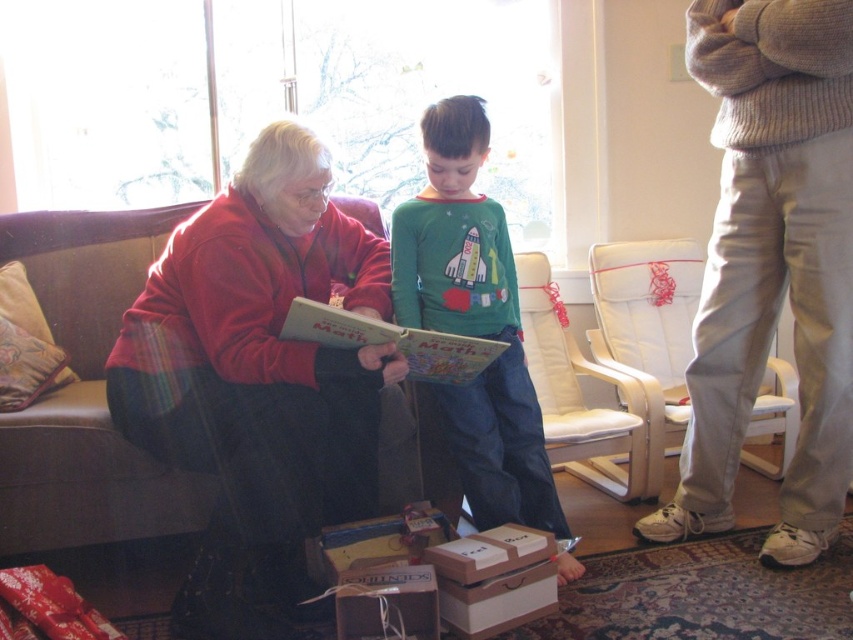
You are a delivery person who needs to place a small package on the lowest shelf of a bookshelf. You see the velvet red sweater at left and the wooden box at lower center. Which object is closer to the floor?

The wooden box at lower center is closer to the floor since it is shorter than the velvet red sweater at left, which is much taller.

You are a delivery person trying to place a large package that is 1.2 meters wide between the beige knit sweater at right and the white leather armchair at center. Can you fit the package between them?

The beige knit sweater at right might be wider than the white leather armchair at center, so the space between them may not be wide enough to accommodate the 1.2 meter package. You should check the exact width before placing it.

You are a furniture designer who wants to place a new small table between the white leather armchair at right and the wooden box at lower center. Considering their heights, which object should the table be placed closer to in order to ensure stability?

The white leather armchair at right is much taller than the wooden box at lower center. To ensure stability, the table should be placed closer to the white leather armchair at right since it has a higher base, allowing the table to rest more securely.